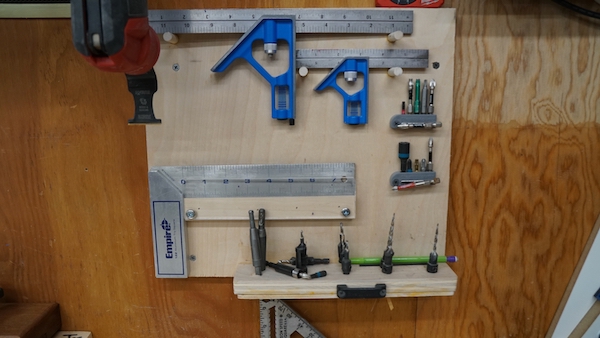
Where is `wood wall`? This screenshot has height=338, width=600. wood wall is located at coordinates (550, 183).